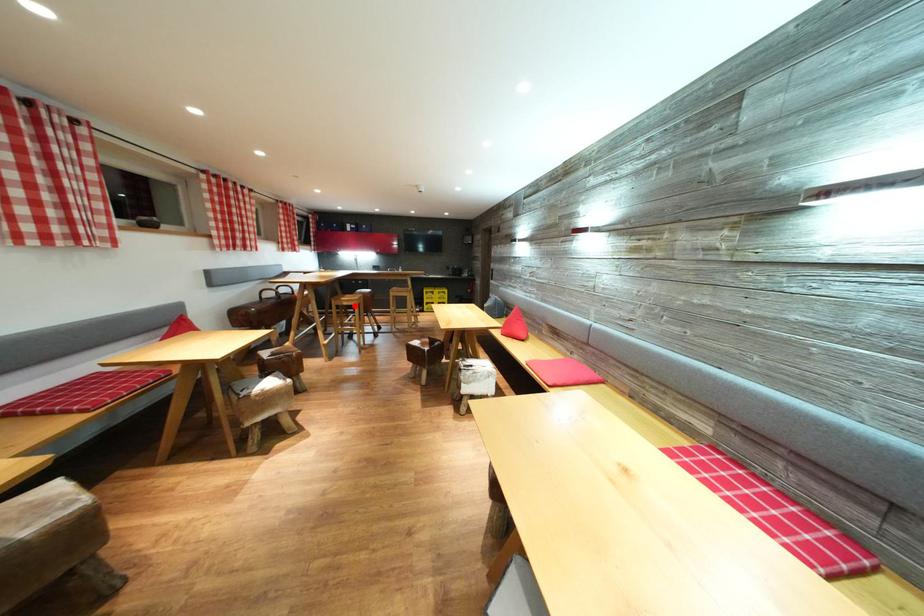
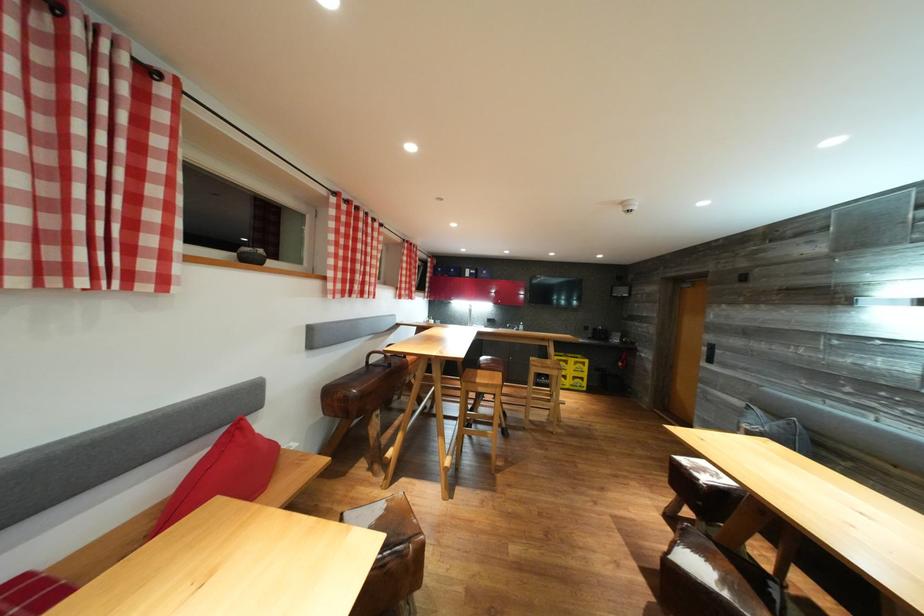
Question: I am providing you with two images of the same scene from different viewpoints. A red point is shown in image1. For the corresponding object point in image2, is it positioned nearer or farther from the camera?

Choices:
 (A) Nearer
 (B) Farther

Answer: (B)